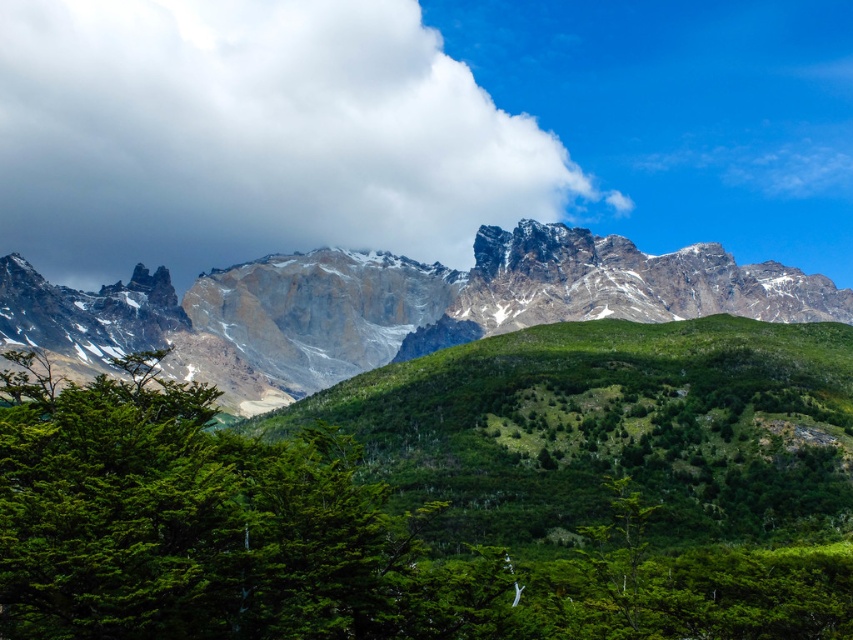
Who is higher up, green grassy hillside at center or rugged granite mountain range at center?

rugged granite mountain range at center is above.

Image resolution: width=853 pixels, height=640 pixels. What do you see at coordinates (610, 429) in the screenshot?
I see `green grassy hillside at center` at bounding box center [610, 429].

Is point (723, 333) positioned behind point (483, 310)?

No, (723, 333) is in front of (483, 310).

Locate an element on the screen. This screenshot has height=640, width=853. green grassy hillside at center is located at coordinates (610, 429).

Who is shorter, white fluffy cloud at upper center or rugged granite mountain range at center?

rugged granite mountain range at center

Looking at this image, does white fluffy cloud at upper center have a larger size compared to rugged granite mountain range at center?

No, white fluffy cloud at upper center is not bigger than rugged granite mountain range at center.

Is point (187, 61) closer to viewer compared to point (390, 284)?

No, (187, 61) is behind (390, 284).

Locate an element on the screen. This screenshot has height=640, width=853. white fluffy cloud at upper center is located at coordinates (254, 138).

In the scene shown: Is green leafy tree at center to the left of green grassy hillside at center from the viewer's perspective?

Correct, you'll find green leafy tree at center to the left of green grassy hillside at center.

Between green leafy tree at center and green grassy hillside at center, which one appears on the left side from the viewer's perspective?

green leafy tree at center is more to the left.

Who is more distant from viewer, (74, 636) or (801, 520)?

The point (801, 520) is more distant.

The width and height of the screenshot is (853, 640). I want to click on green leafy tree at center, so click(x=323, y=540).